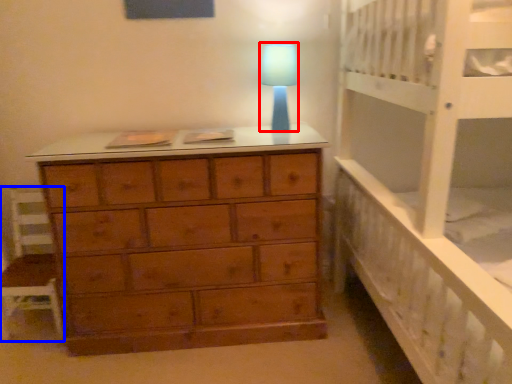
Question: Which object is closer to the camera taking this photo, lamp (highlighted by a red box) or chair (highlighted by a blue box)?

Choices:
 (A) lamp
 (B) chair

Answer: (A)